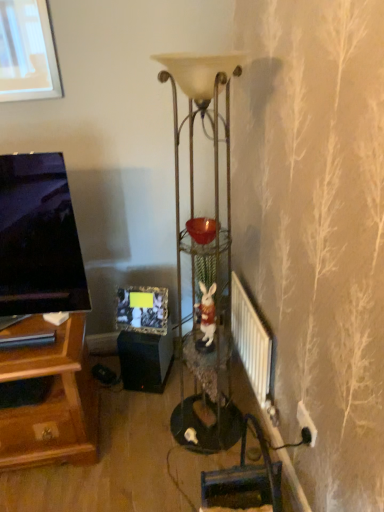
Where is `metallic gold floor lamp at center`? metallic gold floor lamp at center is located at coordinates (205, 245).

This screenshot has width=384, height=512. I want to click on white ceramic rabbit at center, so [207, 313].

Measure the distance between point (x=257, y=389) and camera.

They are 2.03 meters apart.

This screenshot has width=384, height=512. In order to click on black matte speaker at lower center in this screenshot , I will do `click(145, 360)`.

At what (x,y) coordinates should I click in order to perform the action: click on animal above the matte black picture frame at center (from a real-world perspective). Please return your answer as a coordinate pair (x, y). Looking at the image, I should click on (207, 313).

Is white ceramic rabbit at center beside matte black picture frame at center?

No, white ceramic rabbit at center is not in contact with matte black picture frame at center.

Which of these two, white ceramic rabbit at center or matte black picture frame at center, is thinner?

Thinner between the two is matte black picture frame at center.

Considering the positions of point (171, 342) and point (298, 412), is point (171, 342) closer or farther from the camera than point (298, 412)?

Point (171, 342).

From a real-world perspective, between black matte speaker at lower center and white plastic electric outlet at lower right, who is vertically lower?

black matte speaker at lower center is physically lower.

Which object is more forward, black matte speaker at lower center or white plastic electric outlet at lower right?

white plastic electric outlet at lower right is in front.

Does point (312, 426) appear closer or farther from the camera than point (125, 303)?

Point (312, 426) is closer to the camera than point (125, 303).

How many degrees apart are the facing directions of white plastic electric outlet at lower right and matte black picture frame at center?

white plastic electric outlet at lower right and matte black picture frame at center are facing 67.6 degrees away from each other.

Looking at this image, is white plastic electric outlet at lower right in contact with matte black picture frame at center?

No, white plastic electric outlet at lower right is not next to matte black picture frame at center.

How distant is white plastic electric outlet at lower right from matte black picture frame at center?

A distance of 37.02 inches exists between white plastic electric outlet at lower right and matte black picture frame at center.

Between white metallic radiator at lower right and metallic gold floor lamp at center, which one has larger width?

metallic gold floor lamp at center is wider.

The width and height of the screenshot is (384, 512). In the image, there is a metallic gold floor lamp at center. What are the coordinates of `radiator below it (from a real-world perspective)` in the screenshot? It's located at (252, 344).

Considering the positions of objects white metallic radiator at lower right and metallic gold floor lamp at center in the image provided, who is more to the left, white metallic radiator at lower right or metallic gold floor lamp at center?

From the viewer's perspective, metallic gold floor lamp at center appears more on the left side.

From the image's perspective, between white metallic radiator at lower right and metallic gold floor lamp at center, who is located below?

white metallic radiator at lower right, from the image's perspective.

Find the location of a particular element. The image size is (384, 512). animal on the right of metallic gold floor lamp at center is located at coordinates (207, 313).

Is white ceramic rabbit at center to the left of metallic gold floor lamp at center from the viewer's perspective?

No, white ceramic rabbit at center is not to the left of metallic gold floor lamp at center.

Is metallic gold floor lamp at center at the back of white ceramic rabbit at center?

Yes.

Are white ceramic rabbit at center and metallic gold floor lamp at center located far from each other?

white ceramic rabbit at center is actually quite close to metallic gold floor lamp at center.

From a real-world perspective, is white plastic electric outlet at lower right on white ceramic rabbit at center?

No.

How distant is white plastic electric outlet at lower right from white ceramic rabbit at center?

Result: They are 20.35 inches apart.

Looking at this image, can you confirm if white plastic electric outlet at lower right is thinner than white ceramic rabbit at center?

Yes, white plastic electric outlet at lower right is thinner than white ceramic rabbit at center.

Is white plastic electric outlet at lower right oriented away from white ceramic rabbit at center?

No, white plastic electric outlet at lower right is not facing away from white ceramic rabbit at center.

In terms of height, does matte black picture frame at center look taller or shorter compared to black matte speaker at lower center?

matte black picture frame at center is shorter than black matte speaker at lower center.

Is matte black picture frame at center oriented towards black matte speaker at lower center?

No, matte black picture frame at center does not turn towards black matte speaker at lower center.

Consider the image. From a real-world perspective, is matte black picture frame at center under black matte speaker at lower center?

No, from a real-world perspective, matte black picture frame at center is not under black matte speaker at lower center.

Looking at their sizes, would you say matte black picture frame at center is wider or thinner than black matte speaker at lower center?

matte black picture frame at center is thinner than black matte speaker at lower center.

At what (x,y) coordinates should I click in order to perform the action: click on picture frame behind the white ceramic rabbit at center. Please return your answer as a coordinate pair (x, y). Image resolution: width=384 pixels, height=512 pixels. Looking at the image, I should click on (142, 310).

Image resolution: width=384 pixels, height=512 pixels. In order to click on electric outlet below the black matte speaker at lower center (from the image's perspective) in this screenshot , I will do `click(306, 421)`.

From the image, which object appears to be farther from white ceramic rabbit at center, white metallic radiator at lower right or black matte speaker at lower center?

The object further to white ceramic rabbit at center is black matte speaker at lower center.

Based on their spatial positions, is matte black picture frame at center or black matte speaker at lower center closer to white plastic electric outlet at lower right?

The object closer to white plastic electric outlet at lower right is black matte speaker at lower center.

Based on their spatial positions, is white ceramic rabbit at center or metallic gold floor lamp at center closer to white metallic radiator at lower right?

Based on the image, white ceramic rabbit at center appears to be nearer to white metallic radiator at lower right.

Considering their positions, is white plastic electric outlet at lower right positioned closer to white ceramic rabbit at center than metallic gold floor lamp at center?

Based on the image, metallic gold floor lamp at center appears to be nearer to white ceramic rabbit at center.

From the image, which object appears to be nearer to black matte speaker at lower center, metallic gold floor lamp at center or matte black picture frame at center?

Based on the image, matte black picture frame at center appears to be nearer to black matte speaker at lower center.

Considering their positions, is metallic gold floor lamp at center positioned closer to white metallic radiator at lower right than white ceramic rabbit at center?

white ceramic rabbit at center.

Estimate the real-world distances between objects in this image. Which object is further from white metallic radiator at lower right, white plastic electric outlet at lower right or metallic gold floor lamp at center?

white plastic electric outlet at lower right is positioned further to the anchor white metallic radiator at lower right.

Estimate the real-world distances between objects in this image. Which object is further from matte black picture frame at center, white metallic radiator at lower right or black matte speaker at lower center?

white metallic radiator at lower right lies further to matte black picture frame at center than the other object.

Where is `electric outlet positioned between metallic gold floor lamp at center and white ceramic rabbit at center from near to far`? electric outlet positioned between metallic gold floor lamp at center and white ceramic rabbit at center from near to far is located at coordinates (306, 421).

Where is `radiator situated between white ceramic rabbit at center and white plastic electric outlet at lower right from left to right`? Image resolution: width=384 pixels, height=512 pixels. radiator situated between white ceramic rabbit at center and white plastic electric outlet at lower right from left to right is located at coordinates (252, 344).

Where is `radiator located between metallic gold floor lamp at center and black matte speaker at lower center in the depth direction`? This screenshot has height=512, width=384. radiator located between metallic gold floor lamp at center and black matte speaker at lower center in the depth direction is located at coordinates (252, 344).

At what (x,y) coordinates should I click in order to perform the action: click on animal located between black matte speaker at lower center and white plastic electric outlet at lower right in the left-right direction. Please return your answer as a coordinate pair (x, y). Looking at the image, I should click on (207, 313).